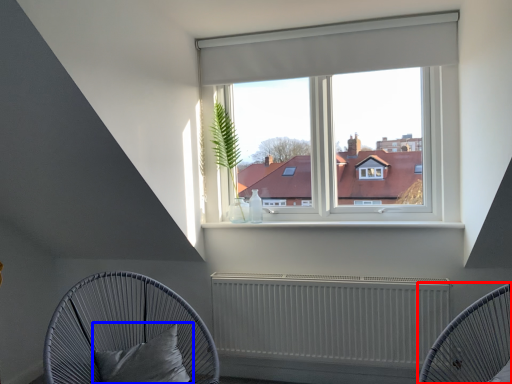
Question: Which object is further to the camera taking this photo, furniture (highlighted by a red box) or pillow (highlighted by a blue box)?

Choices:
 (A) furniture
 (B) pillow

Answer: (B)